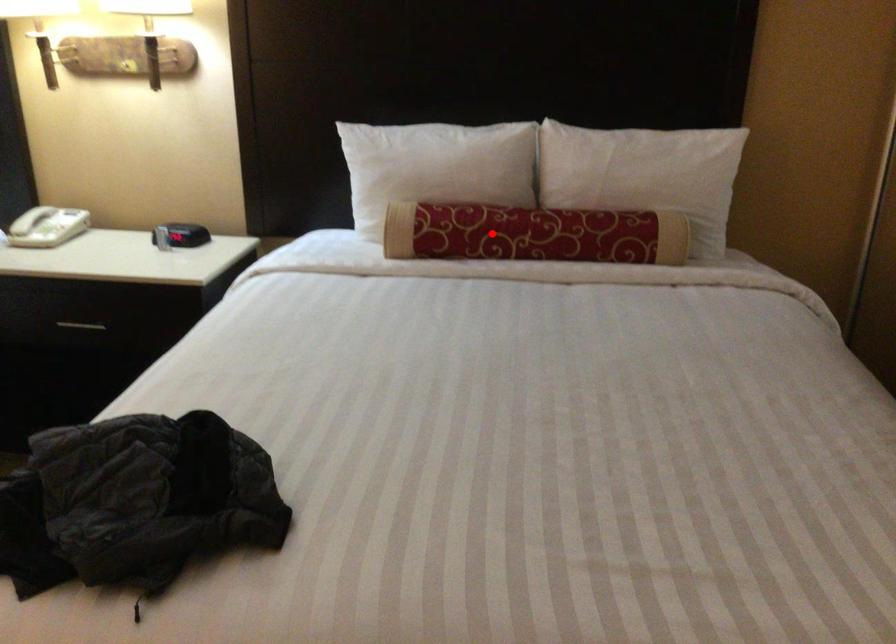
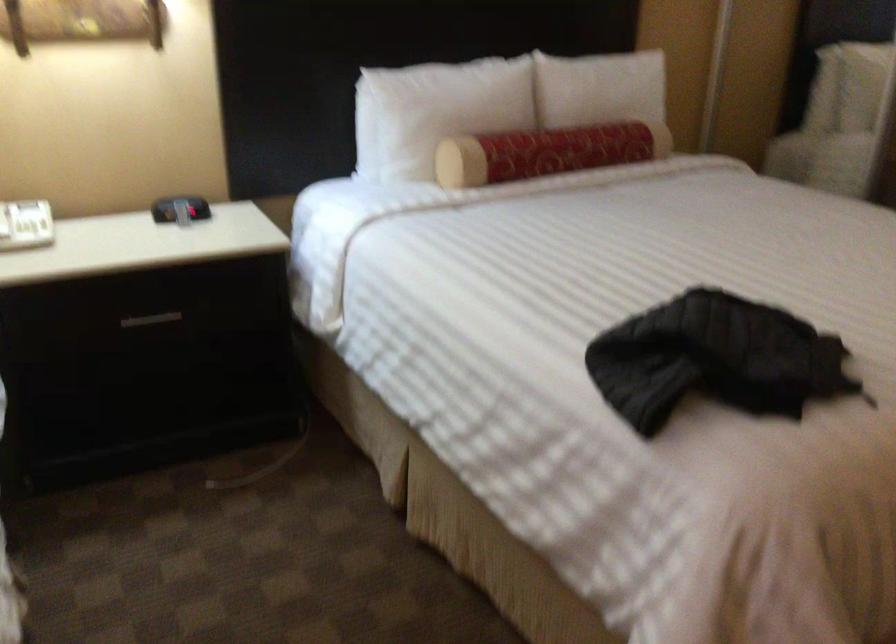
Question: I am providing you with two images of the same scene from different viewpoints. Image1 has a red point marked. In image2, the corresponding 3D location appears at what relative position? Reply with the corresponding letter.

Choices:
 (A) Closer
 (B) Farther

Answer: (B)